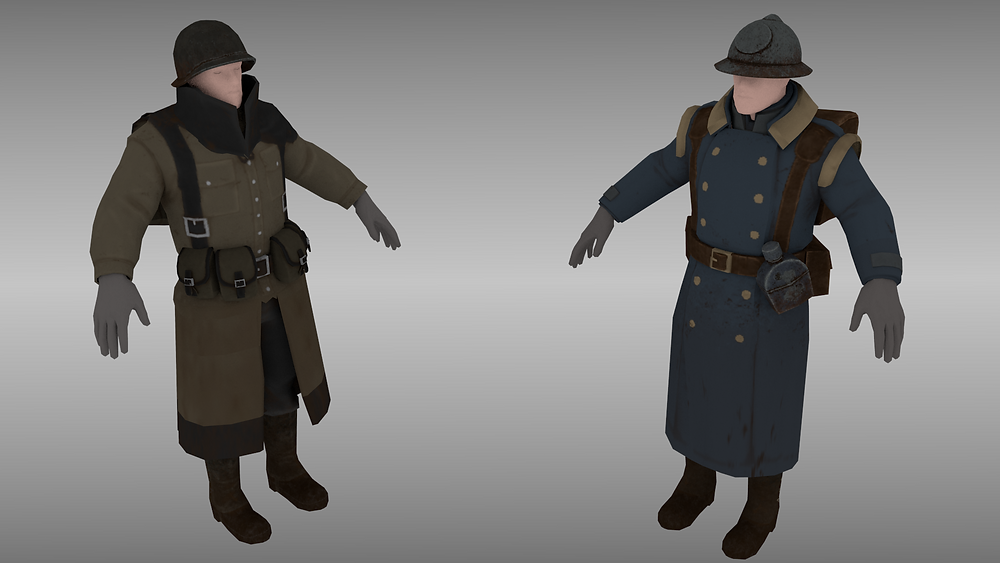
The image size is (1000, 563). I want to click on canteen, so click(x=781, y=281).